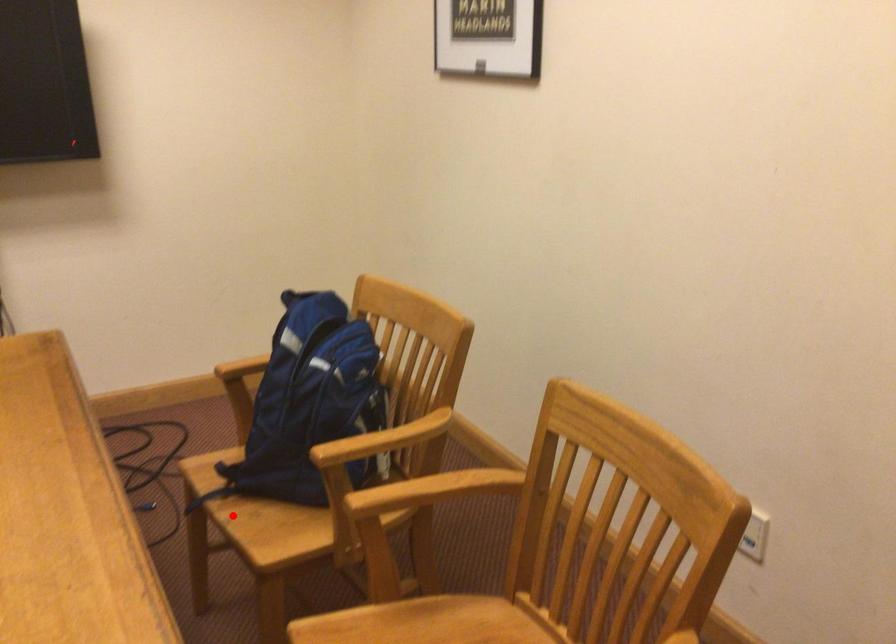
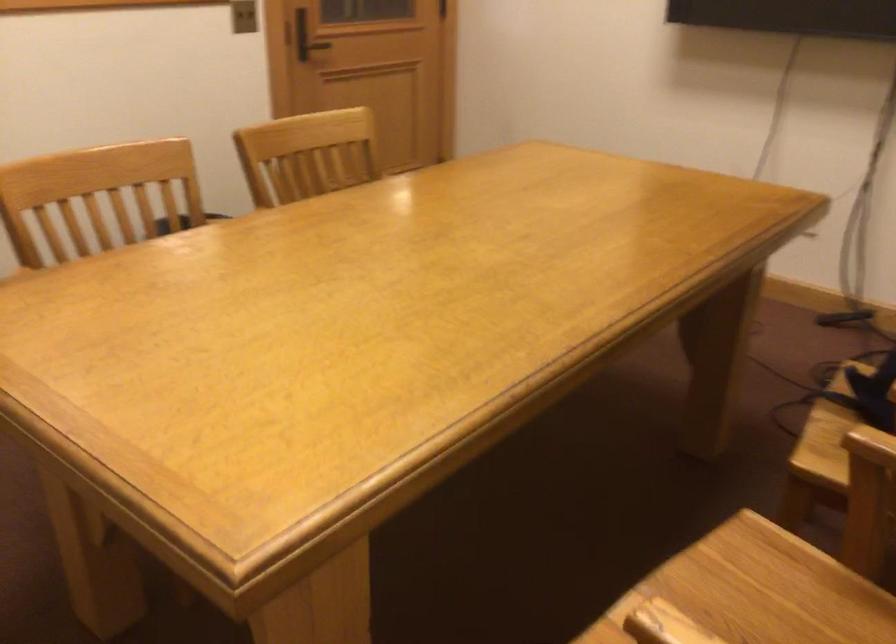
In the second image, find the point that corresponds to the highlighted location in the first image.

(823, 419)